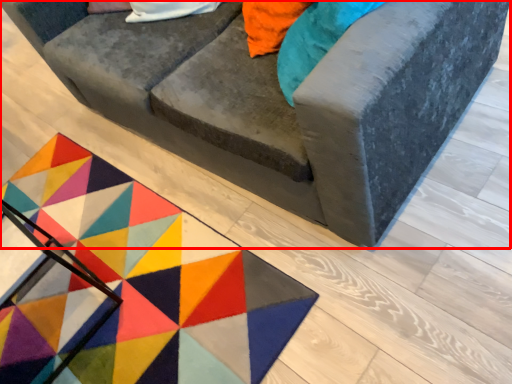
Question: Considering the relative positions of studio couch (annotated by the red box) and mat in the image provided, where is studio couch (annotated by the red box) located with respect to the staircase?

Choices:
 (A) left
 (B) right

Answer: (B)